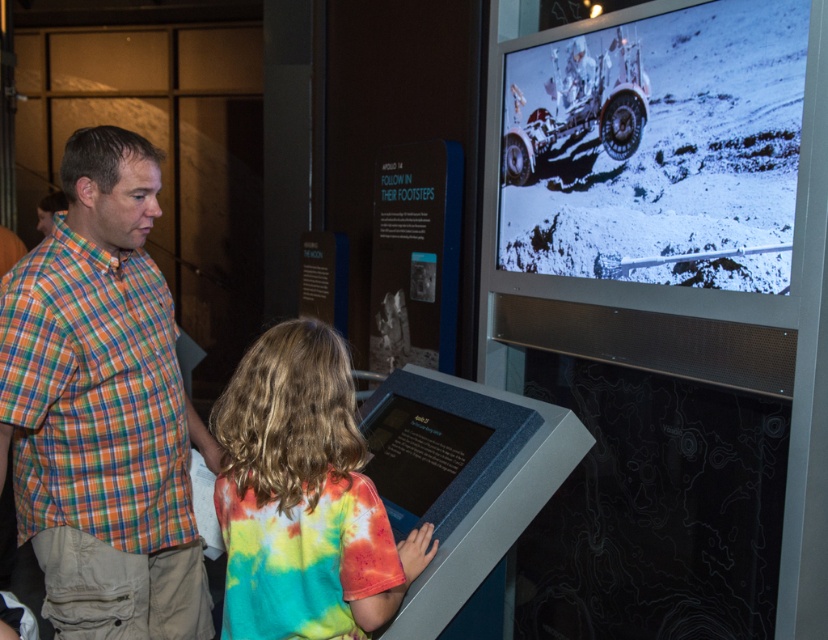
Does multicolored plaid shirt at left have a greater width compared to black matte display at center?

Correct, the width of multicolored plaid shirt at left exceeds that of black matte display at center.

I want to click on multicolored plaid shirt at left, so click(102, 408).

Which is in front, point (119, 625) or point (396, 531)?

Point (396, 531) is more forward.

Locate an element on the screen. The image size is (828, 640). multicolored plaid shirt at left is located at coordinates (102, 408).

Is tie-dye fabric shirt at center closer to the viewer compared to black matte display at center?

Yes, it is.

Is tie-dye fabric shirt at center further to camera compared to black matte display at center?

No, tie-dye fabric shirt at center is in front of black matte display at center.

In order to click on tie-dye fabric shirt at center in this screenshot , I will do `click(302, 497)`.

Is metallic silver rover at upper right positioned in front of tie-dye fabric shirt at center?

No, it is not.

Who is positioned more to the right, metallic silver rover at upper right or tie-dye fabric shirt at center?

From the viewer's perspective, metallic silver rover at upper right appears more on the right side.

Which is behind, point (733, 122) or point (278, 602)?

The point (733, 122) is behind.

Where is `metallic silver rover at upper right`? metallic silver rover at upper right is located at coordinates (657, 148).